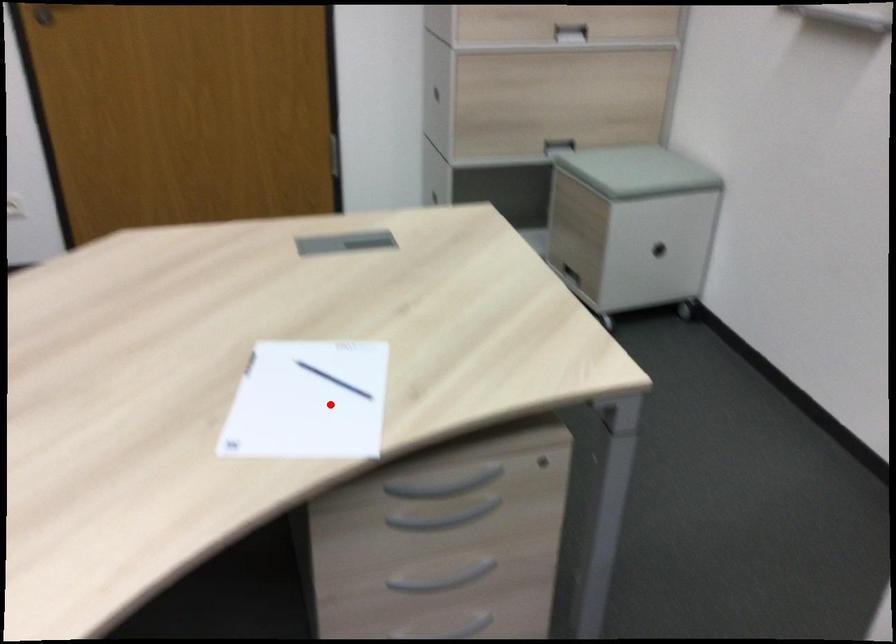
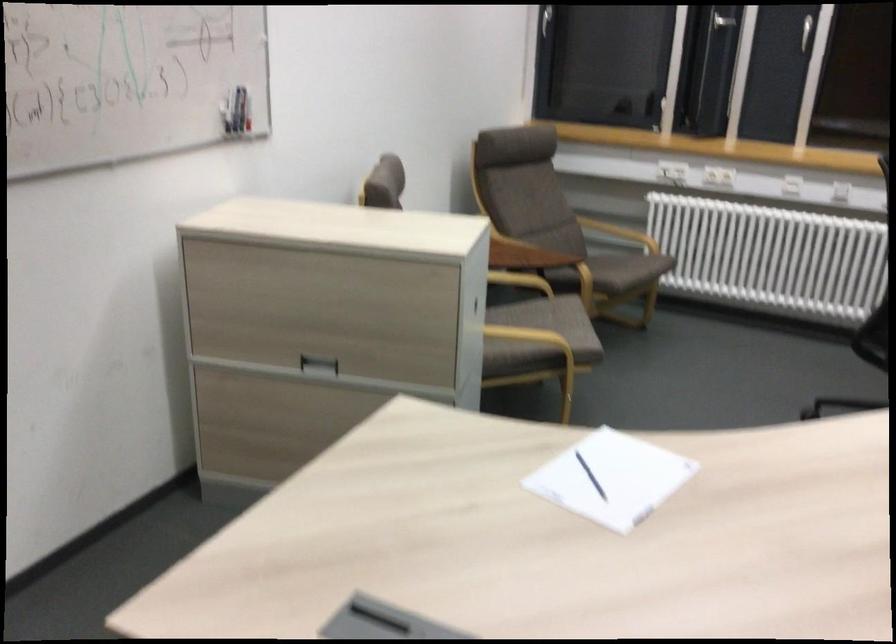
Question: I am providing you with two images of the same scene from different viewpoints. A red point is shown in image1. For the corresponding object point in image2, is it positioned nearer or farther from the camera?

Choices:
 (A) Nearer
 (B) Farther

Answer: (B)